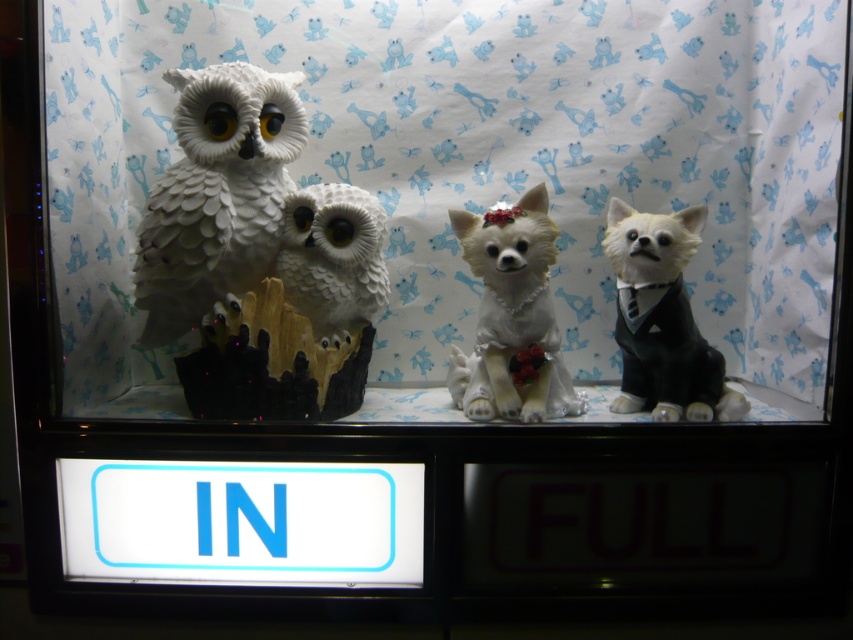
Question: Can you confirm if white porcelain chihuahua at center is positioned above shiny black dog at right?

Choices:
 (A) no
 (B) yes

Answer: (B)

Question: Estimate the real-world distances between objects in this image. Which object is closer to the shiny black dog at right?

Choices:
 (A) white porcelain chihuahua at center
 (B) white matte owl at center
 (C) white glossy owl at left

Answer: (A)

Question: Which of the following is the closest to the observer?

Choices:
 (A) (367, 314)
 (B) (695, 394)
 (C) (260, 115)
 (D) (523, 337)

Answer: (D)

Question: Does white glossy owl at left have a larger size compared to shiny black dog at right?

Choices:
 (A) yes
 (B) no

Answer: (A)

Question: Can you confirm if white porcelain chihuahua at center is bigger than shiny black dog at right?

Choices:
 (A) no
 (B) yes

Answer: (B)

Question: Which object is the closest to the shiny black dog at right?

Choices:
 (A) white matte owl at center
 (B) white porcelain chihuahua at center

Answer: (B)